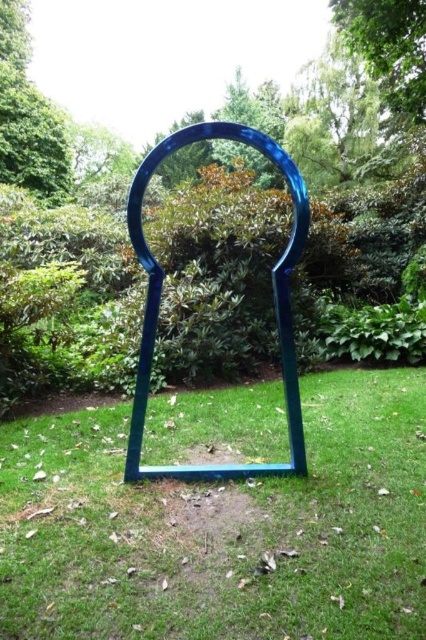
In the scene shown: Does blue glass frame at center have a larger size compared to green leafy tree at center?

Indeed, blue glass frame at center has a larger size compared to green leafy tree at center.

Is point (2, 426) behind point (259, 170)?

No.

Is point (339, 385) positioned behind point (282, 179)?

No, it is in front of (282, 179).

Image resolution: width=426 pixels, height=640 pixels. Identify the location of blue glass frame at center. (221, 529).

Is blue glass frame at center thinner than green leafy tree at upper center?

No.

Between point (62, 612) and point (377, 0), which one is positioned behind?

The point (377, 0) is behind.

Which is behind, point (319, 477) or point (406, 80)?

Positioned behind is point (406, 80).

The height and width of the screenshot is (640, 426). What are the coordinates of `blue glass frame at center` in the screenshot? It's located at (221, 529).

Which is in front, point (26, 44) or point (242, 77)?

Positioned in front is point (26, 44).

Which is behind, point (37, 88) or point (215, 141)?

Positioned behind is point (37, 88).

The height and width of the screenshot is (640, 426). What are the coordinates of `green leafy tree at upper left` in the screenshot? It's located at (28, 115).